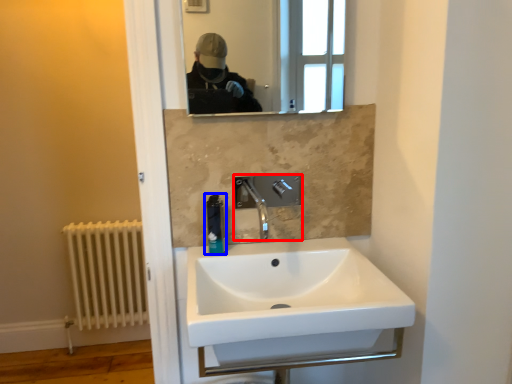
Question: Which object appears farthest to the camera in this image, tap (highlighted by a red box) or soap dispenser (highlighted by a blue box)?

Choices:
 (A) tap
 (B) soap dispenser

Answer: (B)